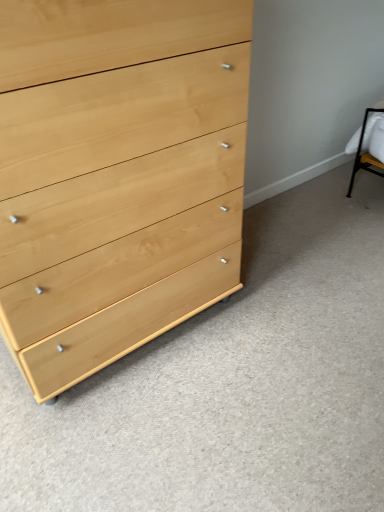
Question: Should I look upward or downward to see light wood dresser at left?

Choices:
 (A) down
 (B) up

Answer: (B)